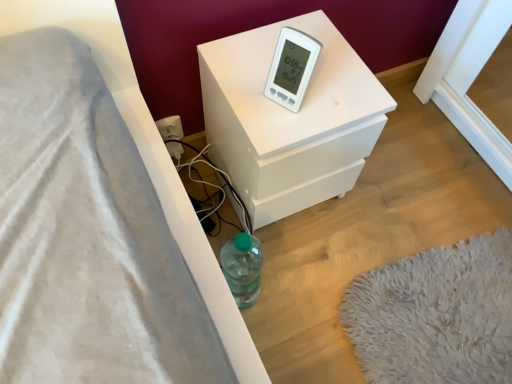
Question: From the image's perspective, would you say white matte nightstand at center is positioned over white plastic thermometer at upper center?

Choices:
 (A) yes
 (B) no

Answer: (B)

Question: Can you confirm if white matte nightstand at center is shorter than white plastic thermometer at upper center?

Choices:
 (A) no
 (B) yes

Answer: (A)

Question: Considering the relative sizes of white matte nightstand at center and white plastic thermometer at upper center in the image provided, is white matte nightstand at center wider than white plastic thermometer at upper center?

Choices:
 (A) yes
 (B) no

Answer: (A)

Question: Is white matte nightstand at center smaller than white plastic thermometer at upper center?

Choices:
 (A) yes
 (B) no

Answer: (B)

Question: From a real-world perspective, is white matte nightstand at center physically above white plastic thermometer at upper center?

Choices:
 (A) yes
 (B) no

Answer: (B)

Question: Can you confirm if white matte nightstand at center is thinner than white plastic thermometer at upper center?

Choices:
 (A) no
 (B) yes

Answer: (A)

Question: Considering the relative sizes of white plastic thermometer at upper center and white matte nightstand at center in the image provided, is white plastic thermometer at upper center taller than white matte nightstand at center?

Choices:
 (A) yes
 (B) no

Answer: (B)

Question: Is white plastic thermometer at upper center outside of white matte nightstand at center?

Choices:
 (A) yes
 (B) no

Answer: (A)

Question: Considering the relative sizes of white plastic thermometer at upper center and white matte nightstand at center in the image provided, is white plastic thermometer at upper center wider than white matte nightstand at center?

Choices:
 (A) no
 (B) yes

Answer: (A)

Question: From a real-world perspective, is white plastic thermometer at upper center located beneath white matte nightstand at center?

Choices:
 (A) no
 (B) yes

Answer: (A)

Question: Is there a large distance between white plastic thermometer at upper center and white matte nightstand at center?

Choices:
 (A) yes
 (B) no

Answer: (B)

Question: Considering the relative sizes of white plastic thermometer at upper center and white matte nightstand at center in the image provided, is white plastic thermometer at upper center smaller than white matte nightstand at center?

Choices:
 (A) yes
 (B) no

Answer: (A)

Question: From the image's perspective, is white plastic thermometer at upper center located above or below white matte nightstand at center?

Choices:
 (A) below
 (B) above

Answer: (B)